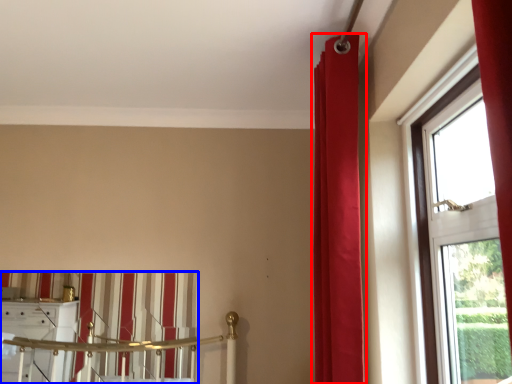
Question: Among these objects, which one is farthest to the camera, curtain (highlighted by a red box) or curtain (highlighted by a blue box)?

Choices:
 (A) curtain
 (B) curtain

Answer: (B)